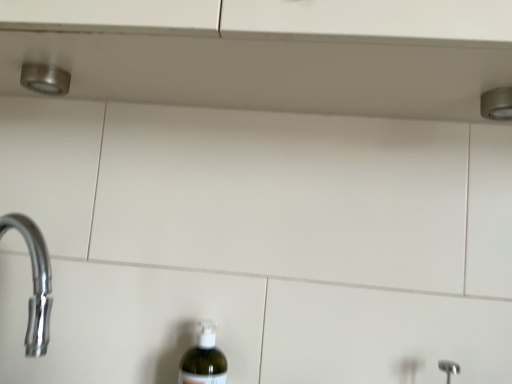
This screenshot has height=384, width=512. Find the location of `translucent plastic bottle at lower center`. translucent plastic bottle at lower center is located at coordinates (203, 360).

Image resolution: width=512 pixels, height=384 pixels. Describe the element at coordinates (203, 360) in the screenshot. I see `translucent plastic bottle at lower center` at that location.

The height and width of the screenshot is (384, 512). I want to click on satin nickel shower at upper right, so click(497, 104).

This screenshot has height=384, width=512. What do you see at coordinates (497, 104) in the screenshot?
I see `satin nickel shower at upper right` at bounding box center [497, 104].

The height and width of the screenshot is (384, 512). In order to click on translucent plastic bottle at lower center in this screenshot , I will do `click(203, 360)`.

Between satin nickel shower at upper right and translucent plastic bottle at lower center, which one appears on the left side from the viewer's perspective?

Positioned to the left is translucent plastic bottle at lower center.

Which is in front, satin nickel shower at upper right or translucent plastic bottle at lower center?

satin nickel shower at upper right is in front.

Is point (496, 116) closer to viewer compared to point (221, 359)?

Yes.

From the image's perspective, between satin nickel shower at upper right and translucent plastic bottle at lower center, which one is located above?

satin nickel shower at upper right, from the image's perspective.

From a real-world perspective, is satin nickel shower at upper right physically located above or below translucent plastic bottle at lower center?

In terms of real-world spatial position, satin nickel shower at upper right is above translucent plastic bottle at lower center.

Does satin nickel shower at upper right have a lesser width compared to translucent plastic bottle at lower center?

Yes, satin nickel shower at upper right is thinner than translucent plastic bottle at lower center.

Considering the relative sizes of satin nickel shower at upper right and translucent plastic bottle at lower center in the image provided, is satin nickel shower at upper right taller than translucent plastic bottle at lower center?

No.

In terms of size, does satin nickel shower at upper right appear bigger or smaller than translucent plastic bottle at lower center?

Considering their sizes, satin nickel shower at upper right takes up less space than translucent plastic bottle at lower center.

Can we say satin nickel shower at upper right lies outside translucent plastic bottle at lower center?

Yes.

Are satin nickel shower at upper right and translucent plastic bottle at lower center far apart?

satin nickel shower at upper right is near translucent plastic bottle at lower center, not far away.

Is satin nickel shower at upper right positioned with its back to translucent plastic bottle at lower center?

No, satin nickel shower at upper right's orientation is not away from translucent plastic bottle at lower center.

Measure the distance from satin nickel shower at upper right to translucent plastic bottle at lower center.

They are 23.01 inches apart.

Where is `shower on the right of translucent plastic bottle at lower center`? The height and width of the screenshot is (384, 512). shower on the right of translucent plastic bottle at lower center is located at coordinates (497, 104).

Based on their positions, is translucent plastic bottle at lower center located to the left or right of satin nickel shower at upper right?

Based on their positions, translucent plastic bottle at lower center is located to the left of satin nickel shower at upper right.

Between translucent plastic bottle at lower center and satin nickel shower at upper right, which one is positioned behind?

translucent plastic bottle at lower center.

Does point (214, 325) lie in front of point (500, 113)?

That is False.

From the image's perspective, is translucent plastic bottle at lower center under satin nickel shower at upper right?

Indeed, from the image's perspective, translucent plastic bottle at lower center is shown beneath satin nickel shower at upper right.

From a real-world perspective, does translucent plastic bottle at lower center sit lower than satin nickel shower at upper right?

Correct, in the physical world, translucent plastic bottle at lower center is lower than satin nickel shower at upper right.

Does translucent plastic bottle at lower center have a greater width compared to satin nickel shower at upper right?

Yes.

From their relative heights in the image, would you say translucent plastic bottle at lower center is taller or shorter than satin nickel shower at upper right?

In the image, translucent plastic bottle at lower center appears to be taller than satin nickel shower at upper right.

Is translucent plastic bottle at lower center bigger or smaller than satin nickel shower at upper right?

translucent plastic bottle at lower center is bigger than satin nickel shower at upper right.

Is translucent plastic bottle at lower center completely or partially outside of satin nickel shower at upper right?

Yes.

Is translucent plastic bottle at lower center beside satin nickel shower at upper right?

translucent plastic bottle at lower center and satin nickel shower at upper right are clearly separated.

Could you tell me if translucent plastic bottle at lower center is turned towards satin nickel shower at upper right?

No, translucent plastic bottle at lower center does not turn towards satin nickel shower at upper right.

Can you tell me how much translucent plastic bottle at lower center and satin nickel shower at upper right differ in facing direction?

The facing directions of translucent plastic bottle at lower center and satin nickel shower at upper right are 1.39 degrees apart.

Based on the photo, how distant is translucent plastic bottle at lower center from satin nickel shower at upper right?

translucent plastic bottle at lower center is 23.01 inches from satin nickel shower at upper right.

Identify the location of shower that appears in front of the translucent plastic bottle at lower center. Image resolution: width=512 pixels, height=384 pixels. (497, 104).

Locate an element on the screen. The height and width of the screenshot is (384, 512). shower that appears above the translucent plastic bottle at lower center (from a real-world perspective) is located at coordinates pyautogui.click(x=497, y=104).

Identify the location of bottle on the left of satin nickel shower at upper right. (203, 360).